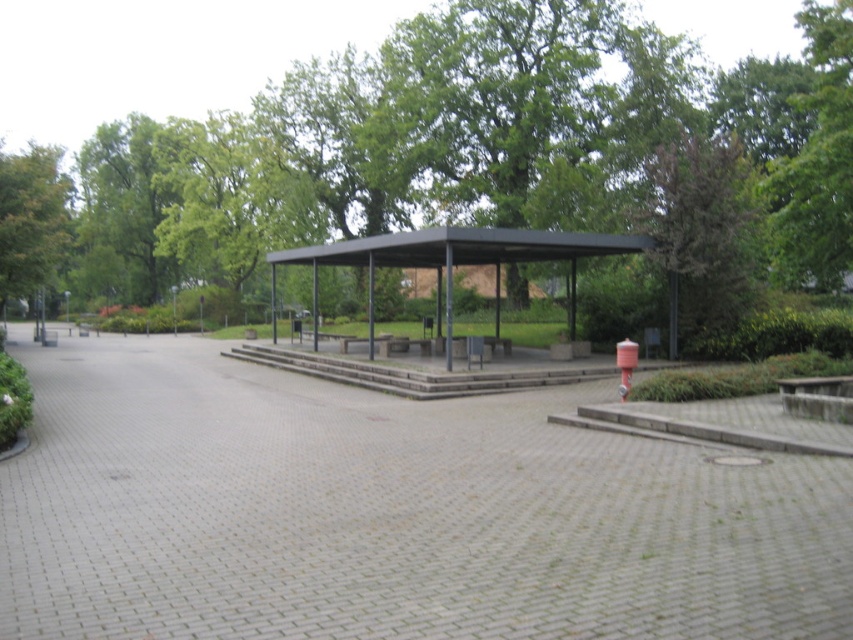
Is gray brick path at center bigger than metallic hydrant at lower right?

Indeed, gray brick path at center has a larger size compared to metallic hydrant at lower right.

Is gray brick path at center to the right of metallic hydrant at lower right from the viewer's perspective?

In fact, gray brick path at center is to the left of metallic hydrant at lower right.

Is point (109, 490) behind point (621, 371)?

That is False.

This screenshot has height=640, width=853. Identify the location of gray brick path at center. [389, 515].

Is green leafy tree at left smaller than metallic hydrant at lower right?

Incorrect, green leafy tree at left is not smaller in size than metallic hydrant at lower right.

Does green leafy tree at left have a lesser width compared to metallic hydrant at lower right?

In fact, green leafy tree at left might be wider than metallic hydrant at lower right.

This screenshot has width=853, height=640. Find the location of `green leafy tree at left`. green leafy tree at left is located at coordinates (30, 220).

Image resolution: width=853 pixels, height=640 pixels. Identify the location of green leafy tree at left. (30, 220).

Is point (596, 52) positioned behind point (637, 348)?

Yes, point (596, 52) is farther from viewer.

Can you confirm if green leafy tree at center is taller than metallic hydrant at lower right?

Yes.

Find the location of a particular element. green leafy tree at center is located at coordinates (494, 157).